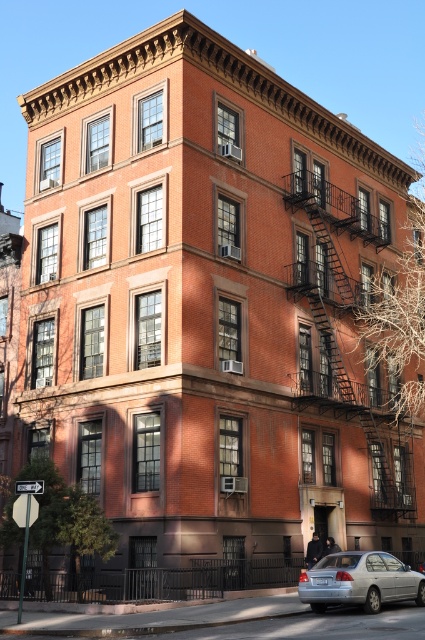
Question: Which point is farther from the camera taking this photo?

Choices:
 (A) (385, 496)
 (B) (340, 593)

Answer: (A)

Question: Can you confirm if rustic metal fire escape at right is positioned to the left of silver metallic sedan at lower right?

Choices:
 (A) yes
 (B) no

Answer: (B)

Question: Where is rustic metal fire escape at right located in relation to silver metallic sedan at lower right in the image?

Choices:
 (A) above
 (B) below

Answer: (A)

Question: Does rustic metal fire escape at right come in front of silver metallic sedan at lower right?

Choices:
 (A) no
 (B) yes

Answer: (A)

Question: Which point is closer to the camera?

Choices:
 (A) rustic metal fire escape at right
 (B) silver metallic sedan at lower right

Answer: (B)